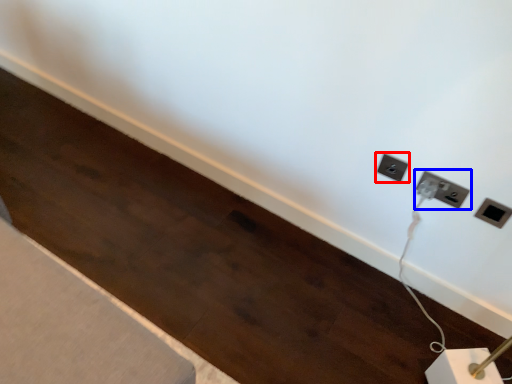
Question: Which object is closer to the camera taking this photo, power plugs and sockets (highlighted by a red box) or power plugs and sockets (highlighted by a blue box)?

Choices:
 (A) power plugs and sockets
 (B) power plugs and sockets

Answer: (B)